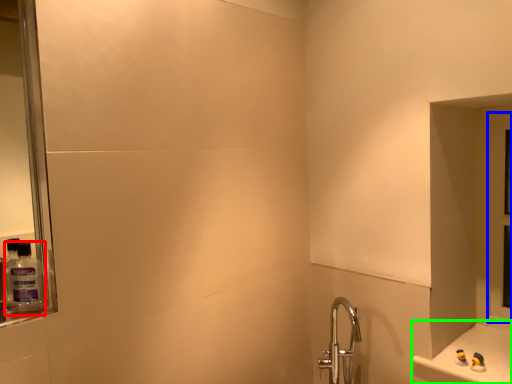
Question: Considering the real-world distances, which object is farthest from mouthwash (highlighted by a red box)? glass door (highlighted by a blue box) or counter (highlighted by a green box)?

Choices:
 (A) glass door
 (B) counter

Answer: (A)